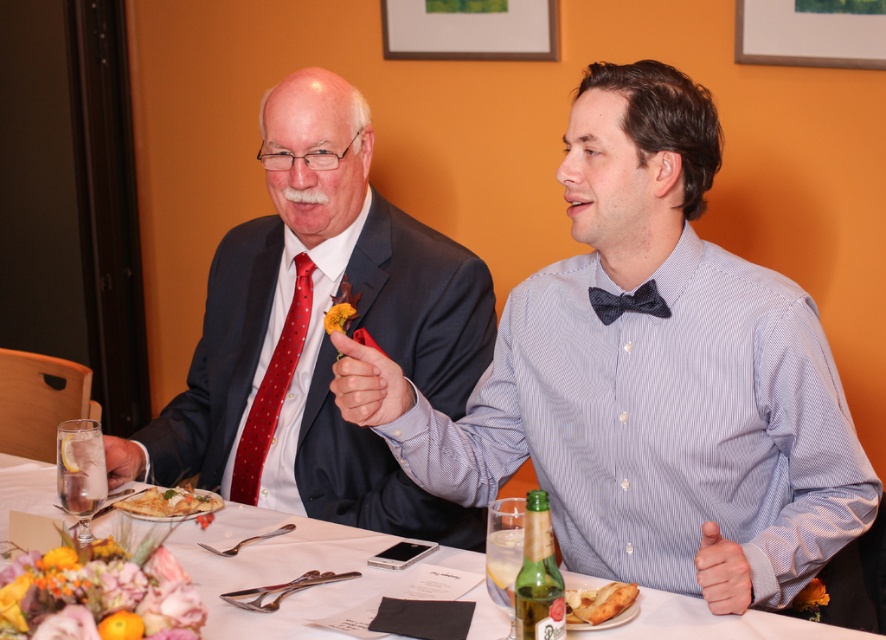
Is point (266, 372) behind point (661, 301)?

Yes.

From the picture: Is red dotted tie at left thinner than dark blue textured bow tie at center?

No, red dotted tie at left is not thinner than dark blue textured bow tie at center.

Between point (255, 403) and point (618, 301), which one is positioned behind?

Point (255, 403)

This screenshot has height=640, width=886. What are the coordinates of `red dotted tie at left` in the screenshot? It's located at (271, 388).

Which of these two, golden crispy flatbread at lower left or golden crispy bread at lower center, stands shorter?

golden crispy flatbread at lower left is shorter.

Is point (136, 506) farther from camera compared to point (622, 595)?

That is True.

Image resolution: width=886 pixels, height=640 pixels. I want to click on golden crispy flatbread at lower left, so click(x=168, y=502).

Does matte black suit at left appear over matte blue shirt at center?

Yes, matte black suit at left is above matte blue shirt at center.

Is matte black suit at left shorter than matte blue shirt at center?

In fact, matte black suit at left may be taller than matte blue shirt at center.

This screenshot has width=886, height=640. Describe the element at coordinates (323, 332) in the screenshot. I see `matte black suit at left` at that location.

Image resolution: width=886 pixels, height=640 pixels. In order to click on matte black suit at left in this screenshot , I will do `click(323, 332)`.